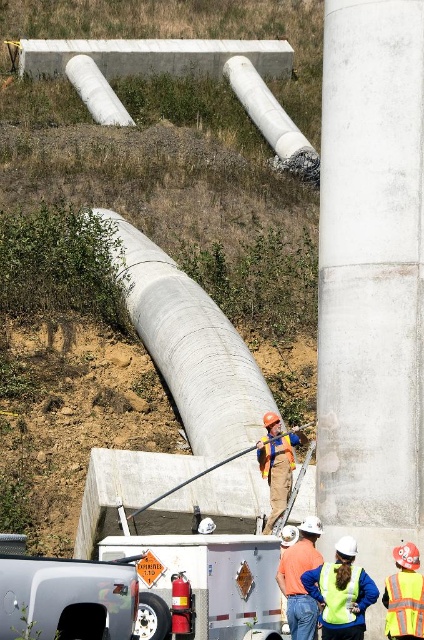
You are a safety inspector checking the construction site. You notice the reflective yellow safety vest at lower right and the white matte water pipe at upper center. Which object is shorter in height?

The reflective yellow safety vest at lower right is shorter than the white matte water pipe at upper center.